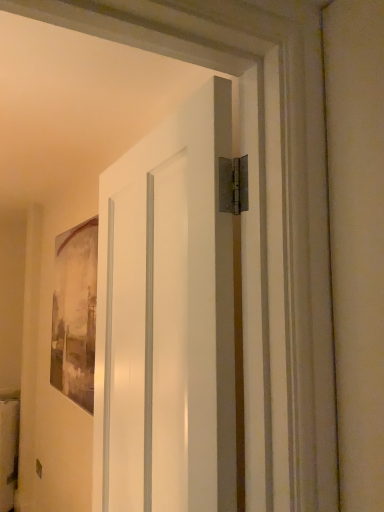
Question: Would you say matte gray painting at left is part of white matte door at center's contents?

Choices:
 (A) yes
 (B) no

Answer: (B)

Question: Is white matte door at center positioned with its back to matte gray painting at left?

Choices:
 (A) yes
 (B) no

Answer: (B)

Question: Considering the relative sizes of white matte door at center and matte gray painting at left in the image provided, is white matte door at center taller than matte gray painting at left?

Choices:
 (A) no
 (B) yes

Answer: (B)

Question: Does white matte door at center have a lesser width compared to matte gray painting at left?

Choices:
 (A) no
 (B) yes

Answer: (A)

Question: From a real-world perspective, is white matte door at center beneath matte gray painting at left?

Choices:
 (A) no
 (B) yes

Answer: (B)

Question: Is white matte door at center completely or partially outside of matte gray painting at left?

Choices:
 (A) no
 (B) yes

Answer: (B)

Question: Can we say matte gray painting at left lies outside white matte door at center?

Choices:
 (A) no
 (B) yes

Answer: (B)

Question: Considering the relative positions of matte gray painting at left and white matte door at center in the image provided, is matte gray painting at left to the left of white matte door at center from the viewer's perspective?

Choices:
 (A) no
 (B) yes

Answer: (B)

Question: Are matte gray painting at left and white matte door at center beside each other?

Choices:
 (A) no
 (B) yes

Answer: (A)

Question: Considering the relative sizes of matte gray painting at left and white matte door at center in the image provided, is matte gray painting at left wider than white matte door at center?

Choices:
 (A) no
 (B) yes

Answer: (A)

Question: Can you confirm if matte gray painting at left is shorter than white matte door at center?

Choices:
 (A) yes
 (B) no

Answer: (A)

Question: Is white matte door at center located within matte gray painting at left?

Choices:
 (A) no
 (B) yes

Answer: (A)

Question: Choose the correct answer: Is matte gray painting at left inside white matte door at center or outside it?

Choices:
 (A) inside
 (B) outside

Answer: (B)